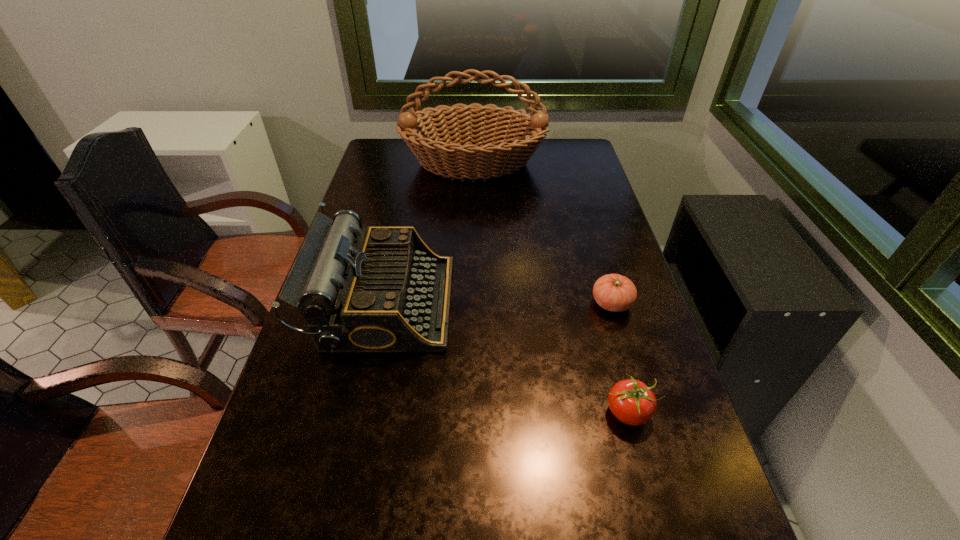
Image resolution: width=960 pixels, height=540 pixels. In order to click on unoccupied area between the basket and the typewriter in this screenshot , I will do `click(428, 233)`.

Find the location of a particular element. The width and height of the screenshot is (960, 540). vacant area that lies between the nearest object and the tallest object is located at coordinates (550, 288).

Locate an element on the screen. vacant space in between the tallest object and the farther tomato is located at coordinates (542, 233).

Where is `vacant area between the farther tomato and the nearest object`? This screenshot has height=540, width=960. vacant area between the farther tomato and the nearest object is located at coordinates (619, 358).

This screenshot has height=540, width=960. Identify the location of empty location between the second tallest object and the farther tomato. (497, 303).

Find the location of a particular element. The image size is (960, 540). vacant region between the farther tomato and the nearest object is located at coordinates [x=619, y=358].

This screenshot has height=540, width=960. Find the location of `free area in between the nearer tomato and the tallest object`. free area in between the nearer tomato and the tallest object is located at coordinates (550, 288).

At what (x,y) coordinates should I click in order to perform the action: click on object that is the second closest to the basket. Please return your answer as a coordinate pair (x, y). Looking at the image, I should click on (616, 293).

Choose which object is the nearest neighbor to the basket. Please provide its 2D coordinates. Your answer should be formatted as a tuple, i.e. [(x, y)], where the tuple contains the x and y coordinates of a point satisfying the conditions above.

[(386, 291)]

Where is `free space that satisfies the following two spatial constraints: 1. on the keyboard of the second tallest object; 2. on the left side of the farther tomato`? The image size is (960, 540). free space that satisfies the following two spatial constraints: 1. on the keyboard of the second tallest object; 2. on the left side of the farther tomato is located at coordinates (383, 303).